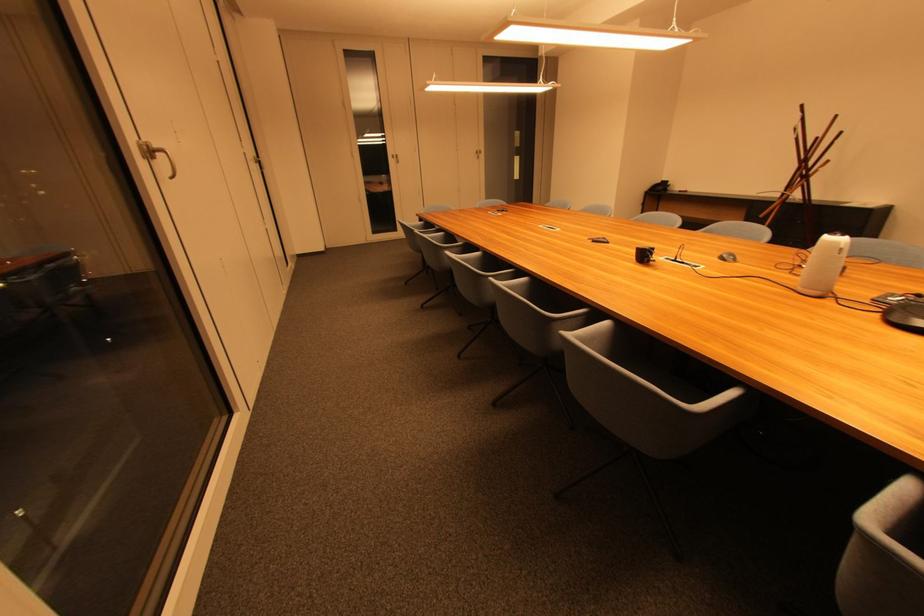
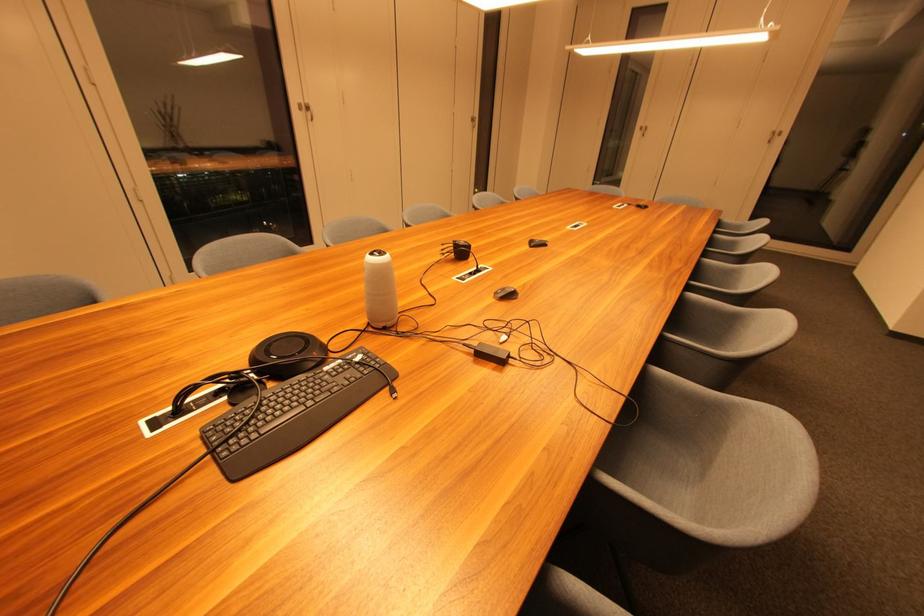
Find the pixel in the second image that matches point (148, 159) in the first image.

(306, 111)